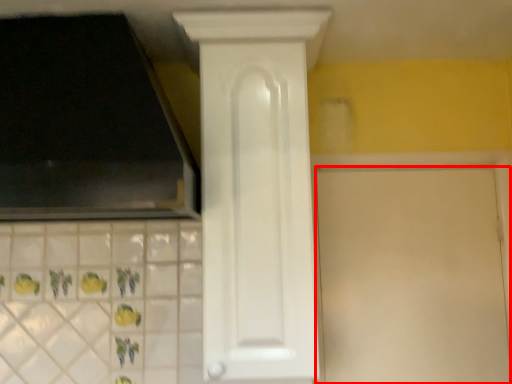
Question: From the image's perspective, what is the correct spatial relationship of door (annotated by the red box) in relation to door?

Choices:
 (A) above
 (B) below

Answer: (B)